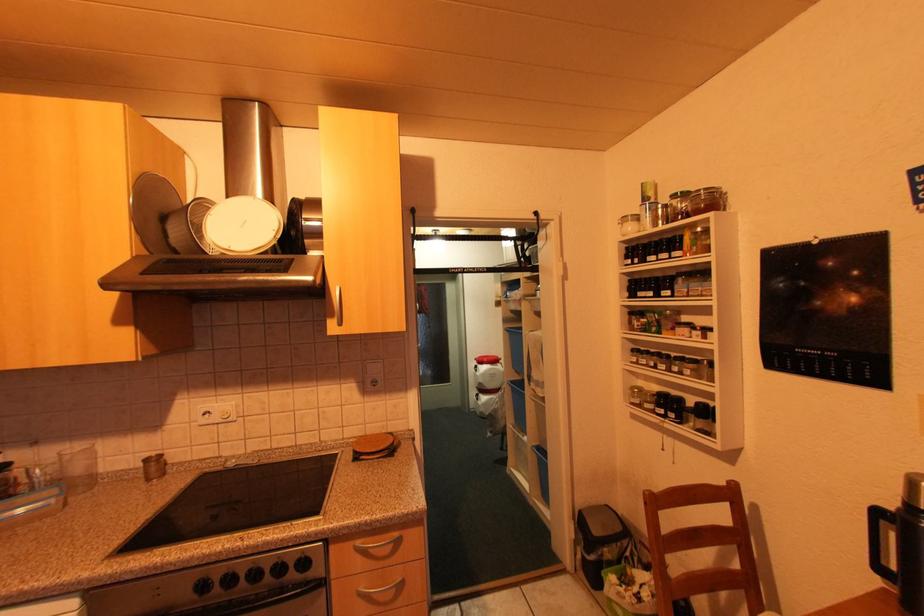
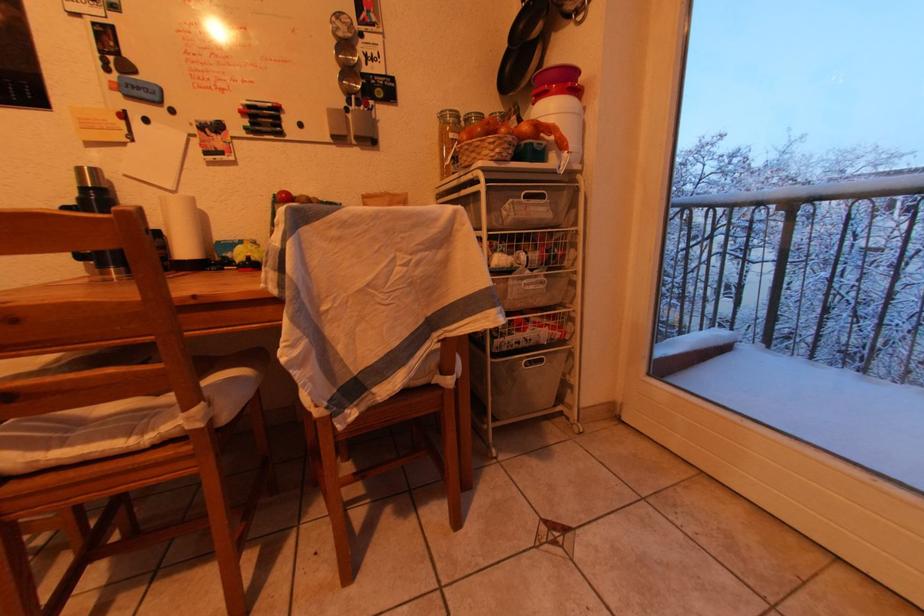
Question: How did the camera likely rotate?

Choices:
 (A) Left
 (B) Right
 (C) Up
 (D) Down

Answer: (B)